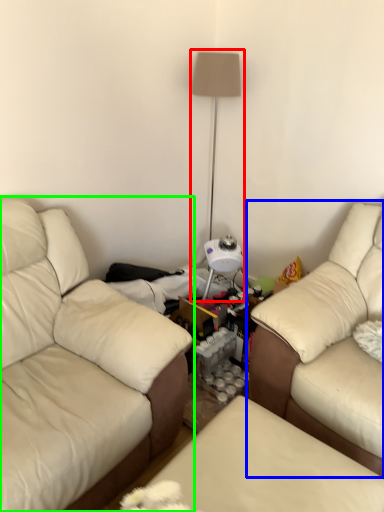
Question: Based on their relative distances, which object is nearer to table lamp (highlighted by a red box)? Choose from studio couch (highlighted by a blue box) and studio couch (highlighted by a green box).

Choices:
 (A) studio couch
 (B) studio couch

Answer: (A)